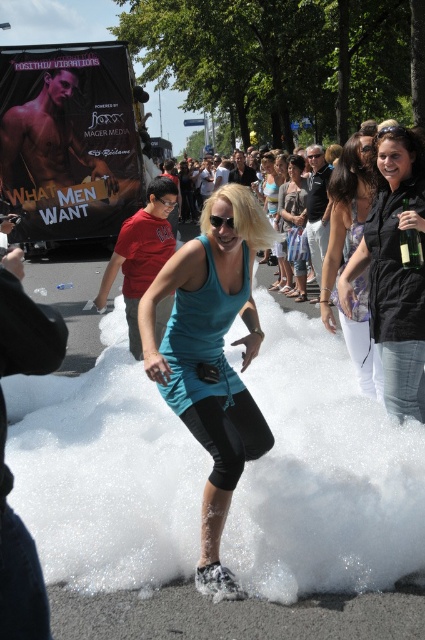
Can you confirm if black matte shirt at upper right is shorter than teal fabric dress at center?

Yes, black matte shirt at upper right is shorter than teal fabric dress at center.

Does black matte shirt at upper right appear on the left side of teal fabric dress at center?

In fact, black matte shirt at upper right is to the right of teal fabric dress at center.

Where is `black matte shirt at upper right`? This screenshot has width=425, height=640. black matte shirt at upper right is located at coordinates (394, 269).

You are a GUI agent. You are given a task and a screenshot of the screen. Output one action in this format:
    pyautogui.click(x=<x>, y=<y>)
    Task: Click on the black matte shirt at upper right
    This screenshot has width=425, height=640.
    Given the screenshot: What is the action you would take?
    pyautogui.click(x=394, y=269)

How much distance is there between white foamy substance at center and teal fabric tank top at center?

white foamy substance at center and teal fabric tank top at center are 1.22 meters apart from each other.

Can you confirm if white foamy substance at center is smaller than teal fabric tank top at center?

No, white foamy substance at center is not smaller than teal fabric tank top at center.

Locate an element on the screen. white foamy substance at center is located at coordinates (323, 474).

Is white foamy substance at center taller than teal fabric dress at center?

In fact, white foamy substance at center may be shorter than teal fabric dress at center.

Can you confirm if white foamy substance at center is smaller than teal fabric dress at center?

No, white foamy substance at center is not smaller than teal fabric dress at center.

Is point (102, 538) farther from viewer compared to point (277, 192)?

No, (102, 538) is closer to viewer.

I want to click on white foamy substance at center, so click(x=323, y=474).